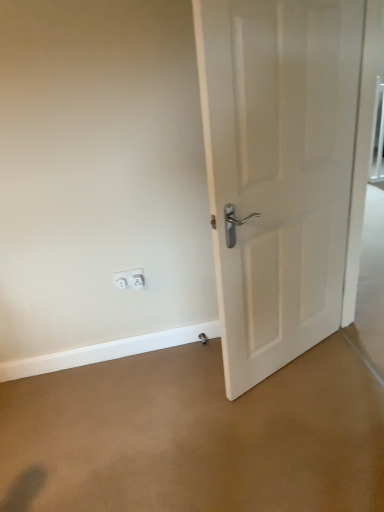
In order to click on free location in front of white matte door at right in this screenshot , I will do `click(301, 422)`.